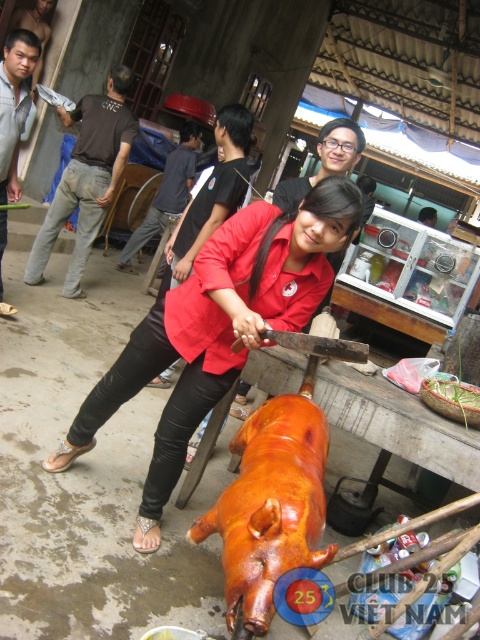
Is point (157, 513) less distant than point (163, 209)?

Yes.

Who is positioned more to the left, matte red shirt at center or dark brown leather jacket at center?

dark brown leather jacket at center is more to the left.

Is point (189, 314) behind point (160, 218)?

No, it is not.

Where is `matte red shirt at center`? matte red shirt at center is located at coordinates (217, 326).

Can you confirm if dark brown leather jacket at center is positioned to the right of smooth brown hair at center?

In fact, dark brown leather jacket at center is to the left of smooth brown hair at center.

Does dark brown leather jacket at center appear under smooth brown hair at center?

Yes.

Describe the element at coordinates (166, 193) in the screenshot. Image resolution: width=480 pixels, height=640 pixels. I see `dark brown leather jacket at center` at that location.

This screenshot has height=640, width=480. I want to click on dark brown leather jacket at center, so click(166, 193).

Consider the image. Which is more to the left, golden-brown roasted pig at center or dark brown leather jacket at center?

Positioned to the left is dark brown leather jacket at center.

In the scene shown: Which of these two, golden-brown roasted pig at center or dark brown leather jacket at center, stands taller?

With more height is dark brown leather jacket at center.

Who is more forward, (x=317, y=417) or (x=144, y=225)?

Point (x=317, y=417)

Where is `golden-brown roasted pig at center`? Image resolution: width=480 pixels, height=640 pixels. golden-brown roasted pig at center is located at coordinates tap(271, 506).